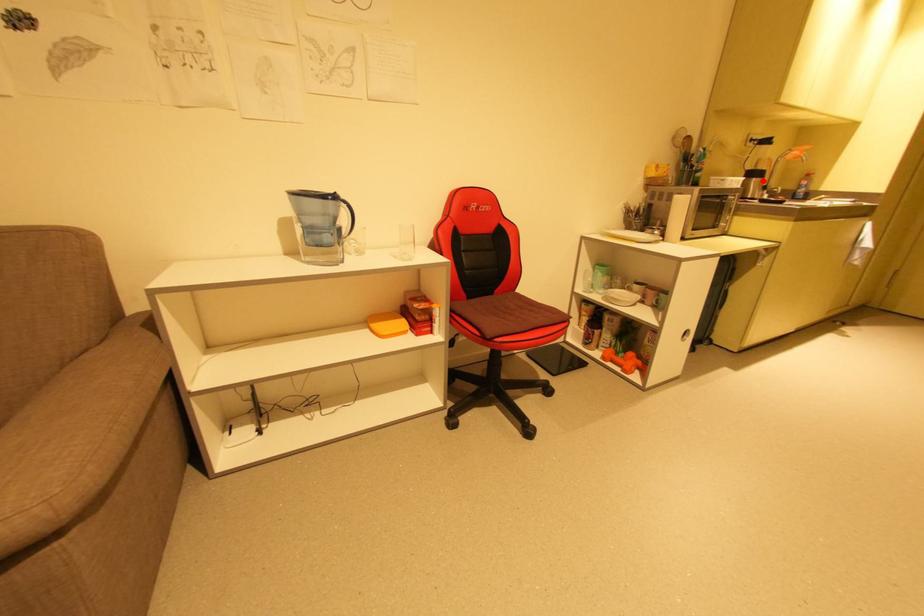
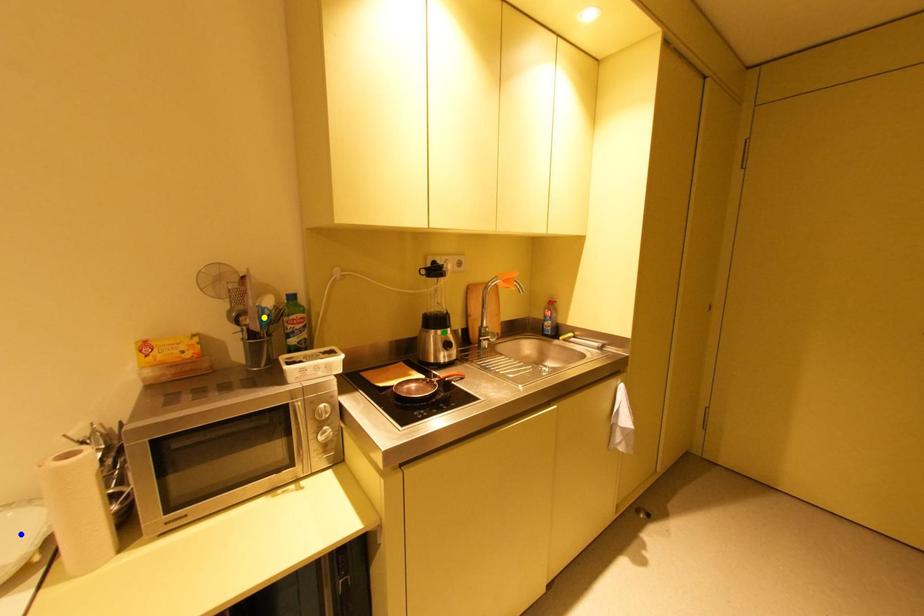
Question: I am providing you with two images of the same scene from different viewpoints. A red point is marked on the first image. You are given multiple points on the second image. Which point in image 2 is actually the same real-world point as the red point in image 1?

Choices:
 (A) green point
 (B) blue point
 (C) yellow point

Answer: (A)